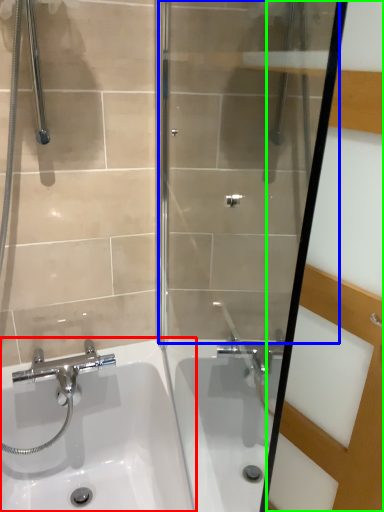
Question: Based on their relative distances, which object is farther from sink (highlighted by a red box)? Choose from shower door (highlighted by a blue box) and screen door (highlighted by a green box).

Choices:
 (A) shower door
 (B) screen door

Answer: (B)